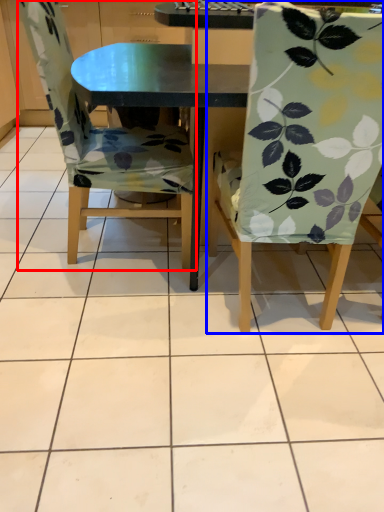
Question: Which object appears closest to the camera in this image, chair (highlighted by a red box) or chair (highlighted by a blue box)?

Choices:
 (A) chair
 (B) chair

Answer: (B)